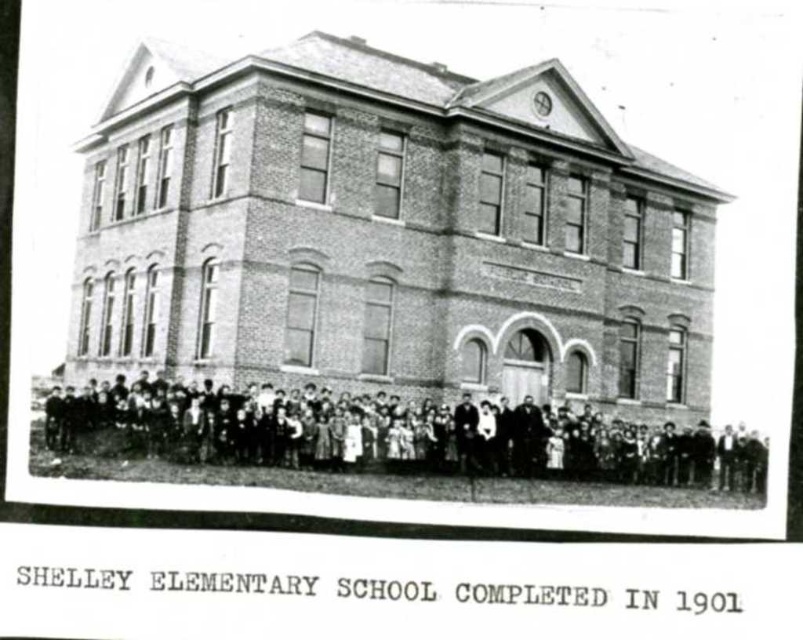
Can you confirm if dark clothing group at center is wider than smooth black suit at center?

Correct, the width of dark clothing group at center exceeds that of smooth black suit at center.

Based on the photo, who is positioned more to the right, dark clothing group at center or smooth black suit at center?

smooth black suit at center is more to the right.

Where is `dark clothing group at center`? Image resolution: width=803 pixels, height=640 pixels. dark clothing group at center is located at coordinates (386, 436).